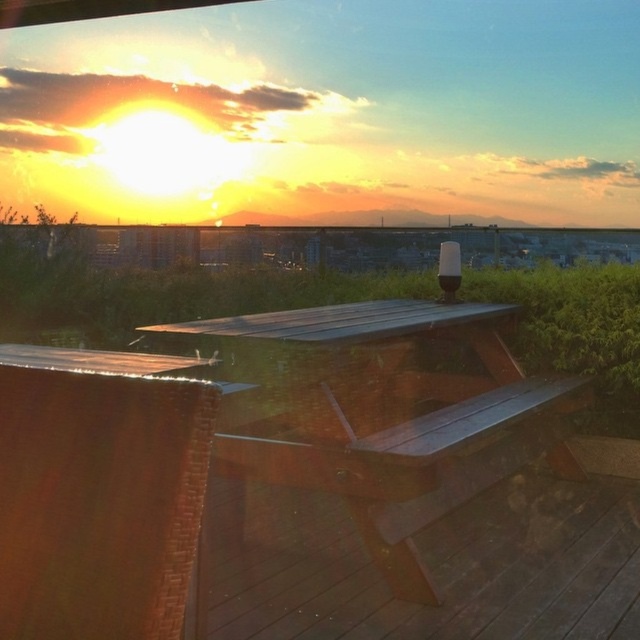
Which is more to the left, brown wooden deck at center or smooth wood table at center?

smooth wood table at center

Does point (611, 449) come in front of point (36, 616)?

No, it is behind (36, 616).

The width and height of the screenshot is (640, 640). I want to click on brown wooden deck at center, so click(417, 561).

Is point (68, 412) positioned before point (353, 442)?

That is True.

Can you confirm if smooth wood table at center is positioned to the left of dark brown wood picnic table at center?

Indeed, smooth wood table at center is positioned on the left side of dark brown wood picnic table at center.

Identify the location of smooth wood table at center. (99, 492).

Where is `smooth wood table at center`? The image size is (640, 640). smooth wood table at center is located at coordinates (99, 492).

Who is taller, brown wooden deck at center or dark brown wood picnic table at center?

With more height is dark brown wood picnic table at center.

Is brown wooden deck at center wider than dark brown wood picnic table at center?

Correct, the width of brown wooden deck at center exceeds that of dark brown wood picnic table at center.

The height and width of the screenshot is (640, 640). In order to click on brown wooden deck at center in this screenshot , I will do `click(417, 561)`.